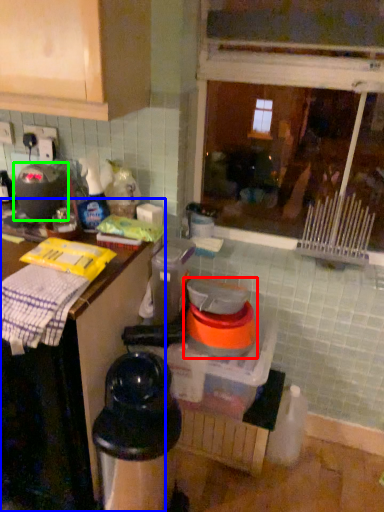
Question: Considering the real-world distances, which object is closest to appliance (highlighted by a red box)? countertop (highlighted by a blue box) or appliance (highlighted by a green box).

Choices:
 (A) countertop
 (B) appliance

Answer: (A)